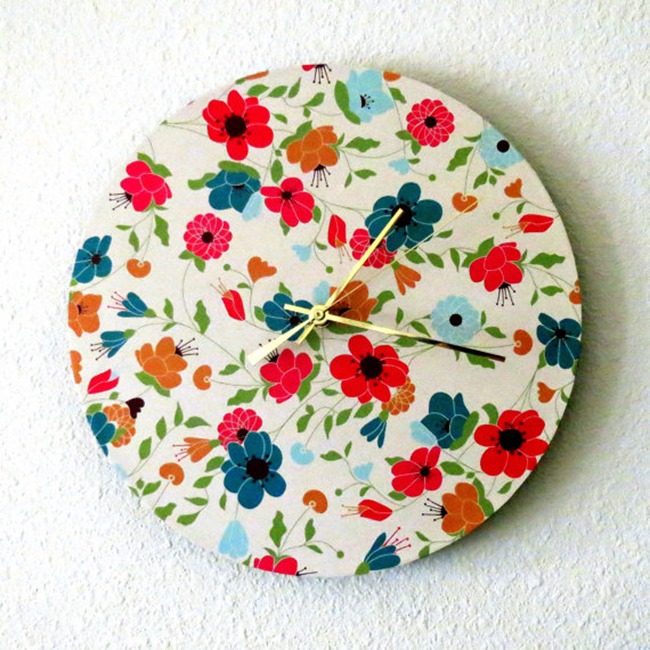
Find the location of a particular element. The height and width of the screenshot is (650, 650). white wall clock with flower pattern is located at coordinates pyautogui.click(x=205, y=290).